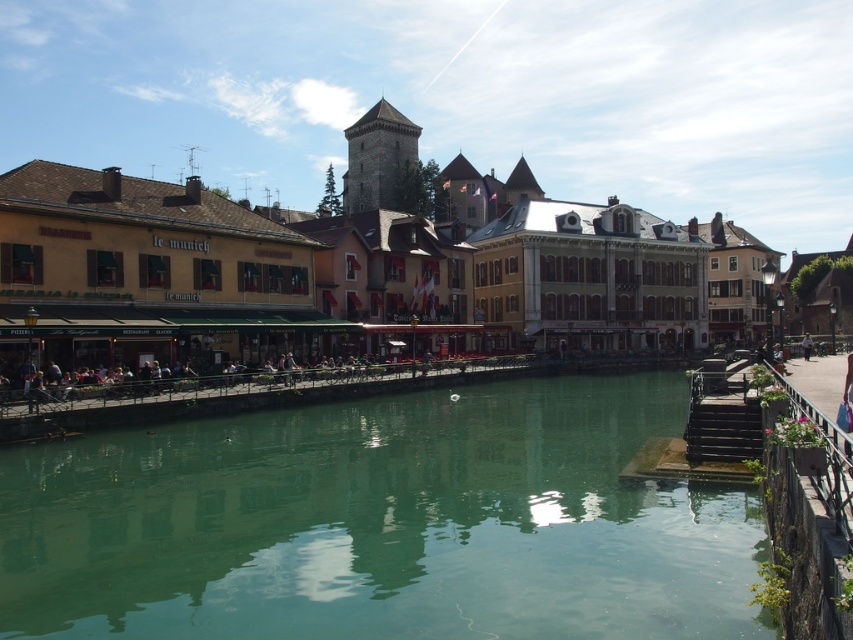
Question: Does green reflective water at lower center have a larger size compared to yellow wooden buildings at center?

Choices:
 (A) no
 (B) yes

Answer: (A)

Question: Where is yellow wooden buildings at center located in relation to light brown leather jacket at center in the image?

Choices:
 (A) above
 (B) below

Answer: (A)

Question: Which point appears farthest from the camera in this image?

Choices:
 (A) (801, 348)
 (B) (575, 321)
 (C) (209, 572)

Answer: (B)

Question: Which point is closer to the camera?

Choices:
 (A) (802, 342)
 (B) (413, 131)

Answer: (A)

Question: Which point appears closest to the camera in this image?

Choices:
 (A) (223, 573)
 (B) (741, 432)

Answer: (A)

Question: Does green reflective water at lower center appear over wooden stairs at lower right?

Choices:
 (A) no
 (B) yes

Answer: (A)